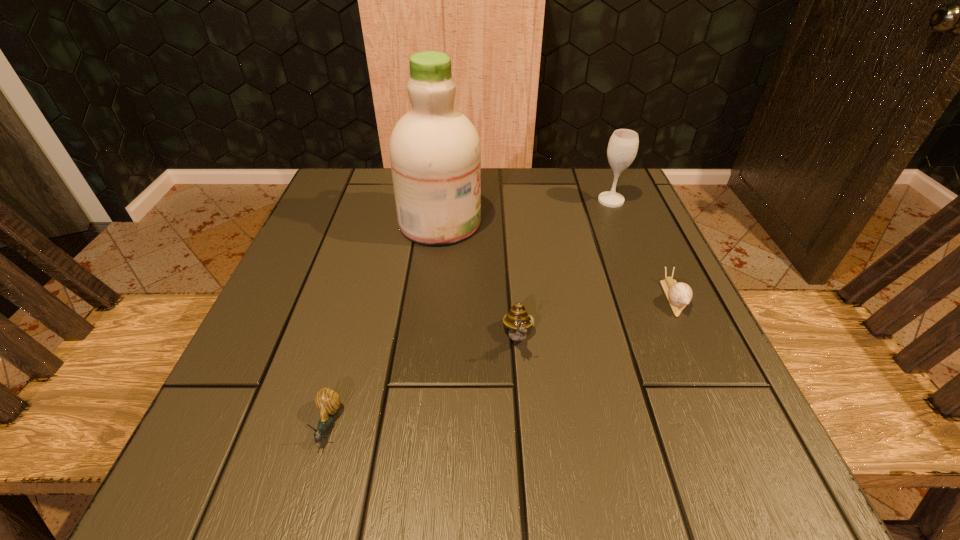
You are a GUI agent. You are given a task and a screenshot of the screen. Output one action in this format:
    pyautogui.click(x=<x>, y=<y>)
    Task: Click on the empty space between the tallest escargot and the cleansing agent
    
    Given the screenshot: What is the action you would take?
    pyautogui.click(x=479, y=280)

At what (x,y) coordinates should I click in order to perform the action: click on empty location between the nearest object and the second object from left to right. Please return your answer as a coordinate pair (x, y). This screenshot has width=960, height=540. Looking at the image, I should click on (384, 323).

Locate an element on the screen. Image resolution: width=960 pixels, height=540 pixels. vacant area between the tallest object and the second escargot from right to left is located at coordinates (479, 280).

Locate an element on the screen. The image size is (960, 540). free space between the fourth shortest object and the rightmost escargot is located at coordinates (642, 249).

Locate an element on the screen. The width and height of the screenshot is (960, 540). free spot between the wineglass and the second escargot from right to left is located at coordinates (564, 269).

In order to click on free space between the wineglass and the fourth object from right to left in this screenshot , I will do point(525,212).

Locate an element on the screen. unoccupied area between the cleansing agent and the third tallest object is located at coordinates (479, 280).

Locate an element on the screen. The image size is (960, 540). empty location between the rightmost escargot and the second tallest object is located at coordinates (642, 249).

This screenshot has height=540, width=960. Identify the location of vacant space in between the second tallest object and the leftmost escargot. (469, 313).

Point out which object is positioned as the nearest to the nearest escargot. Please provide its 2D coordinates. Your answer should be formatted as a tuple, i.e. [(x, y)], where the tuple contains the x and y coordinates of a point satisfying the conditions above.

[(517, 320)]